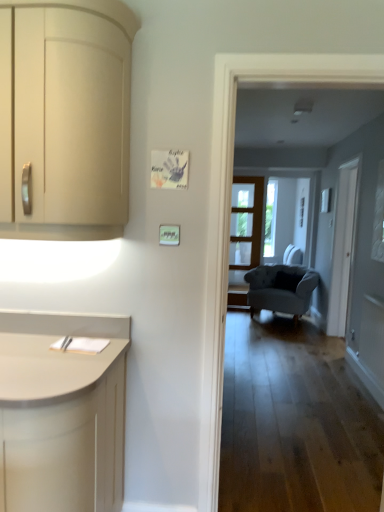
What do you see at coordinates (281, 288) in the screenshot? This screenshot has width=384, height=512. I see `velvet grey armchair at center` at bounding box center [281, 288].

The width and height of the screenshot is (384, 512). Describe the element at coordinates (379, 218) in the screenshot. I see `transparent glass window at upper right` at that location.

Describe the element at coordinates (246, 222) in the screenshot. The image size is (384, 512). I see `clear glass door at center` at that location.

This screenshot has height=512, width=384. I want to click on white glass screen door at right, so click(x=342, y=249).

Is transparent glass window at upper right completely or partially inside velvet grey armchair at center?

No, velvet grey armchair at center does not contain transparent glass window at upper right.

Are velvet grey armchair at center and transparent glass window at upper right located far from each other?

Absolutely, velvet grey armchair at center is distant from transparent glass window at upper right.

From the image's perspective, which object appears higher, velvet grey armchair at center or transparent glass window at upper right?

transparent glass window at upper right, from the image's perspective.

Between point (377, 186) and point (90, 200), which one is positioned behind?

The point (377, 186) is behind.

Is transparent glass window at upper right placed right next to matte cream cabinet at left?

transparent glass window at upper right and matte cream cabinet at left are not in contact.

Is transparent glass window at upper right looking in the opposite direction of matte cream cabinet at left?

No, matte cream cabinet at left is not at the back of transparent glass window at upper right.

From a real-world perspective, who is located lower, matte cream cabinet at left or white glass screen door at right?

white glass screen door at right, from a real-world perspective.

Does matte cream cabinet at left touch white glass screen door at right?

No, matte cream cabinet at left is not with white glass screen door at right.

Is matte cream cabinet at left at the right side of white glass screen door at right?

No.

You are a GUI agent. You are given a task and a screenshot of the screen. Output one action in this format:
    pyautogui.click(x=<x>, y=<y>)
    Task: Click on the screen door below the matte cream cabinet at left (from a real-world perspective)
    
    Given the screenshot: What is the action you would take?
    pyautogui.click(x=342, y=249)

From a real-world perspective, is gray fabric armchair at center positioned above or below transparent glass window at upper right?

In terms of real-world spatial position, gray fabric armchair at center is below transparent glass window at upper right.

How many degrees apart are the facing directions of gray fabric armchair at center and transparent glass window at upper right?

They differ by 90.1 degrees in their facing directions.

Is gray fabric armchair at center positioned before transparent glass window at upper right?

Yes, it is in front of transparent glass window at upper right.

Does gray fabric armchair at center appear on the left side of transparent glass window at upper right?

Correct, you'll find gray fabric armchair at center to the left of transparent glass window at upper right.

Which is behind, point (310, 59) or point (346, 206)?

The point (346, 206) is farther.

How different are the orientations of gray fabric armchair at center and white glass screen door at right in degrees?

90.1 degrees.

Does gray fabric armchair at center come behind white glass screen door at right?

No, gray fabric armchair at center is closer to the camera.

Is gray fabric armchair at center smaller than white glass screen door at right?

Yes, gray fabric armchair at center is smaller than white glass screen door at right.

Does point (29, 136) appear closer or farther from the camera than point (268, 276)?

Point (29, 136) is closer to the camera than point (268, 276).

Are matte cream cabinet at left and velvet grey armchair at center far apart?

Yes.

Between matte cream cabinet at left and velvet grey armchair at center, which one has larger size?

velvet grey armchair at center.

Considering the relative sizes of matte cream cabinet at left and velvet grey armchair at center in the image provided, is matte cream cabinet at left wider than velvet grey armchair at center?

In fact, matte cream cabinet at left might be narrower than velvet grey armchair at center.

Looking at this image, are clear glass door at center and matte cream cabinet at left far apart?

That's right, there is a large distance between clear glass door at center and matte cream cabinet at left.

From a real-world perspective, is clear glass door at center physically above matte cream cabinet at left?

No.

Does point (256, 231) come in front of point (74, 223)?

No.

Image resolution: width=384 pixels, height=512 pixels. I want to click on window in front of the velvet grey armchair at center, so click(379, 218).

Where is `window behind the matte cream cabinet at left`? The image size is (384, 512). window behind the matte cream cabinet at left is located at coordinates (379, 218).

When comparing their distances from transparent glass window at upper right, does matte cream cabinet at left or clear glass door at center seem further?

Based on the image, clear glass door at center appears to be further to transparent glass window at upper right.

Which object lies further to the anchor point transparent glass window at upper right, white glass screen door at right or matte cream cabinet at left?

matte cream cabinet at left lies further to transparent glass window at upper right than the other object.

Considering their positions, is velvet grey armchair at center positioned further to gray fabric armchair at center than matte cream cabinet at left?

Based on the image, velvet grey armchair at center appears to be further to gray fabric armchair at center.

From the image, which object appears to be nearer to gray fabric armchair at center, matte cream cabinet at left or white glass screen door at right?

matte cream cabinet at left.

When comparing their distances from clear glass door at center, does velvet grey armchair at center or transparent glass window at upper right seem closer?

velvet grey armchair at center is positioned closer to the anchor clear glass door at center.

Looking at the image, which one is located further to white glass screen door at right, velvet grey armchair at center or transparent glass window at upper right?

velvet grey armchair at center.

Looking at the image, which one is located further to white glass screen door at right, matte cream cabinet at left or transparent glass window at upper right?

The object further to white glass screen door at right is matte cream cabinet at left.

Looking at the image, which one is located further to matte cream cabinet at left, velvet grey armchair at center or transparent glass window at upper right?

Among the two, velvet grey armchair at center is located further to matte cream cabinet at left.

You are a GUI agent. You are given a task and a screenshot of the screen. Output one action in this format:
    pyautogui.click(x=<x>, y=<y>)
    Task: Click on the window between matte cream cabinet at left and white glass screen door at right in the front-back direction
    The height and width of the screenshot is (512, 384).
    Given the screenshot: What is the action you would take?
    pyautogui.click(x=379, y=218)

The width and height of the screenshot is (384, 512). In order to click on window between gray fabric armchair at center and clear glass door at center from front to back in this screenshot , I will do pos(379,218).

Identify the location of chair between white glass screen door at right and clear glass door at center in the front-back direction. (281, 288).

Where is `window between gray fabric armchair at center and velvet grey armchair at center in the front-back direction`? The height and width of the screenshot is (512, 384). window between gray fabric armchair at center and velvet grey armchair at center in the front-back direction is located at coordinates (379, 218).